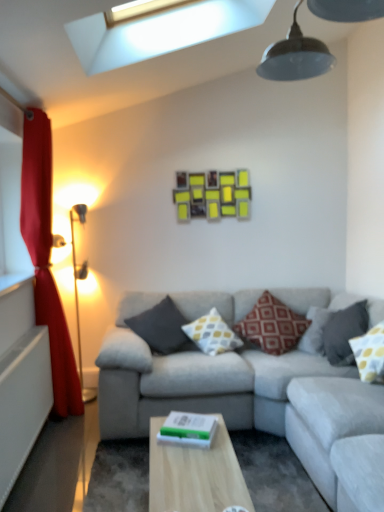
What is the approximate width of gray fabric couch at center?

gray fabric couch at center is 2.22 meters in width.

Find the location of `gray fabric couch at center`. gray fabric couch at center is located at coordinates (228, 393).

The width and height of the screenshot is (384, 512). Describe the element at coordinates (212, 194) in the screenshot. I see `yellow matte picture frame at upper center` at that location.

Image resolution: width=384 pixels, height=512 pixels. Describe the element at coordinates (370, 354) in the screenshot. I see `yellow dotted fabric pillow at right, the first pillow in the right-to-left sequence` at that location.

Locate an element on the screen. The height and width of the screenshot is (512, 384). red velvet curtain at left is located at coordinates pyautogui.click(x=46, y=259).

Find the location of a particular element. The image size is (384, 512). gray fabric couch at center is located at coordinates (228, 393).

Considering the relative positions of gold metallic floor lamp at left and yellow dotted fabric pillow at right, marked as the fifth pillow in a left-to-right arrangement, in the image provided, is gold metallic floor lamp at left to the left or to the right of yellow dotted fabric pillow at right, marked as the fifth pillow in a left-to-right arrangement,?

gold metallic floor lamp at left is positioned on yellow dotted fabric pillow at right, marked as the fifth pillow in a left-to-right arrangement,'s left side.

Measure the distance from gold metallic floor lamp at left to yellow dotted fabric pillow at right, the first pillow in the right-to-left sequence.

They are 7.26 feet apart.

Is gold metallic floor lamp at left smaller than yellow dotted fabric pillow at right, marked as the fifth pillow in a left-to-right arrangement?

Actually, gold metallic floor lamp at left might be larger than yellow dotted fabric pillow at right, marked as the fifth pillow in a left-to-right arrangement.

From a real-world perspective, is gold metallic floor lamp at left positioned under yellow dotted fabric pillow at right, the first pillow in the right-to-left sequence, based on gravity?

No, from a real-world perspective, gold metallic floor lamp at left is not under yellow dotted fabric pillow at right, the first pillow in the right-to-left sequence.

Is point (214, 341) positioned after point (78, 338)?

That is False.

Is yellow dotted pillow at center, positioned as the fourth pillow in right-to-left order, spatially inside gold metallic floor lamp at left, or outside of it?

yellow dotted pillow at center, positioned as the fourth pillow in right-to-left order, is not inside gold metallic floor lamp at left, it's outside.

From a real-world perspective, is yellow dotted pillow at center, positioned as the fourth pillow in right-to-left order, physically below gold metallic floor lamp at left?

Yes, from a real-world perspective, yellow dotted pillow at center, positioned as the fourth pillow in right-to-left order, is below gold metallic floor lamp at left.

How far apart are yellow dotted pillow at center, the 2th pillow from the left, and gold metallic floor lamp at left?

yellow dotted pillow at center, the 2th pillow from the left, is 3.62 feet from gold metallic floor lamp at left.

I want to click on the 4th pillow positioned below the yellow matte picture frame at upper center (from the image's perspective), so click(162, 328).

How many degrees apart are the facing directions of yellow matte picture frame at upper center and dark gray fabric pillow at center, which is counted as the 5th pillow, starting from the right?

The facing directions of yellow matte picture frame at upper center and dark gray fabric pillow at center, which is counted as the 5th pillow, starting from the right, are 0.816 degrees apart.

Visually, is yellow matte picture frame at upper center positioned to the left or to the right of dark gray fabric pillow at center, marked as the 1th pillow in a left-to-right arrangement?

yellow matte picture frame at upper center is positioned on dark gray fabric pillow at center, marked as the 1th pillow in a left-to-right arrangement,'s right side.

Does yellow matte picture frame at upper center have a greater width compared to dark gray fabric pillow at center, which is counted as the 5th pillow, starting from the right?

In fact, yellow matte picture frame at upper center might be narrower than dark gray fabric pillow at center, which is counted as the 5th pillow, starting from the right.

Which object is thinner, yellow dotted pillow at center, positioned as the fourth pillow in right-to-left order, or red velvet curtain at left?

Thinner between the two is red velvet curtain at left.

From the image's perspective, relative to red velvet curtain at left, is yellow dotted pillow at center, positioned as the fourth pillow in right-to-left order, above or below?

Based on their image positions, yellow dotted pillow at center, positioned as the fourth pillow in right-to-left order, is located beneath red velvet curtain at left.

Is yellow dotted pillow at center, positioned as the fourth pillow in right-to-left order, outside of red velvet curtain at left?

yellow dotted pillow at center, positioned as the fourth pillow in right-to-left order, lies outside red velvet curtain at left's area.

Considering the relative positions of yellow dotted pillow at center, the 2th pillow from the left, and red velvet curtain at left in the image provided, is yellow dotted pillow at center, the 2th pillow from the left, in front of red velvet curtain at left?

No, yellow dotted pillow at center, the 2th pillow from the left, is further to the viewer.

From the picture: Would you consider dark gray fabric pillow at right, which ranks as the 4th pillow in left-to-right order, to be distant from light wood table at center?

Indeed, dark gray fabric pillow at right, which ranks as the 4th pillow in left-to-right order, is not near light wood table at center.

Is light wood table at center inside dark gray fabric pillow at right, which ranks as the 4th pillow in left-to-right order?

No, light wood table at center is not surrounded by dark gray fabric pillow at right, which ranks as the 4th pillow in left-to-right order.

From the image's perspective, which one is positioned lower, dark gray fabric pillow at right, which ranks as the 4th pillow in left-to-right order, or light wood table at center?

light wood table at center, from the image's perspective.

Which object is wider, dark gray fabric pillow at right, acting as the 2th pillow starting from the right, or light wood table at center?

light wood table at center.

Looking at this image, who is more distant, gold metallic floor lamp at left or red textured pillow at center, which appears as the third pillow when viewed from the left?

gold metallic floor lamp at left is behind.

From the gold metallic floor lamp at left, count 1st pillows forward and point to it. Please provide its 2D coordinates.

[(272, 325)]

Is the surface of gold metallic floor lamp at left in direct contact with red textured pillow at center, which appears as the third pillow when viewed from the left?

gold metallic floor lamp at left and red textured pillow at center, which appears as the third pillow when viewed from the left, are clearly separated.

Is point (171, 327) closer to camera compared to point (245, 325)?

Yes, point (171, 327) is closer to viewer.

Based on the photo, is dark gray fabric pillow at center, which is counted as the 5th pillow, starting from the right, with red textured pillow at center, which appears as the third pillow when viewed from the left?

No, dark gray fabric pillow at center, which is counted as the 5th pillow, starting from the right, is not beside red textured pillow at center, which appears as the third pillow when viewed from the left.

Is dark gray fabric pillow at center, marked as the 1th pillow in a left-to-right arrangement, aimed at red textured pillow at center, which is counted as the 3th pillow, starting from the right?

No, dark gray fabric pillow at center, marked as the 1th pillow in a left-to-right arrangement, is not aimed at red textured pillow at center, which is counted as the 3th pillow, starting from the right.

From a real-world perspective, relative to red textured pillow at center, which appears as the third pillow when viewed from the left, is dark gray fabric pillow at center, which is counted as the 5th pillow, starting from the right, vertically above or below?

From a real-world perspective, dark gray fabric pillow at center, which is counted as the 5th pillow, starting from the right, is physically below red textured pillow at center, which appears as the third pillow when viewed from the left.

The image size is (384, 512). Identify the location of the 5th pillow counting from the right side of the gold metallic floor lamp at left. (370, 354).

Where is `the 2nd pillow below the gold metallic floor lamp at left (from a real-world perspective)`? The image size is (384, 512). the 2nd pillow below the gold metallic floor lamp at left (from a real-world perspective) is located at coordinates (212, 334).

From the image, which object appears to be nearer to dark gray fabric pillow at center, marked as the 1th pillow in a left-to-right arrangement, yellow dotted fabric pillow at right, marked as the fifth pillow in a left-to-right arrangement, or gold metallic floor lamp at left?

gold metallic floor lamp at left.

When comparing their distances from dark gray fabric pillow at right, acting as the 2th pillow starting from the right, does light wood table at center or yellow dotted pillow at center, positioned as the fourth pillow in right-to-left order, seem further?

light wood table at center is positioned further to the anchor dark gray fabric pillow at right, acting as the 2th pillow starting from the right.

Estimate the real-world distances between objects in this image. Which object is further from red textured pillow at center, which is counted as the 3th pillow, starting from the right, gold metallic floor lamp at left or dark gray fabric pillow at right, acting as the 2th pillow starting from the right?

Among the two, gold metallic floor lamp at left is located further to red textured pillow at center, which is counted as the 3th pillow, starting from the right.

When comparing their distances from dark gray fabric pillow at center, which is counted as the 5th pillow, starting from the right, does red textured pillow at center, which is counted as the 3th pillow, starting from the right, or light wood table at center seem further?

light wood table at center.

Estimate the real-world distances between objects in this image. Which object is further from red velvet curtain at left, yellow dotted fabric pillow at right, marked as the fifth pillow in a left-to-right arrangement, or red textured pillow at center, which is counted as the 3th pillow, starting from the right?

yellow dotted fabric pillow at right, marked as the fifth pillow in a left-to-right arrangement.

Estimate the real-world distances between objects in this image. Which object is closer to gray fabric couch at center, dark gray fabric pillow at center, marked as the 1th pillow in a left-to-right arrangement, or red textured pillow at center, which appears as the third pillow when viewed from the left?

red textured pillow at center, which appears as the third pillow when viewed from the left.

Looking at the image, which one is located closer to red velvet curtain at left, gray fabric couch at center or red textured pillow at center, which appears as the third pillow when viewed from the left?

Among the two, gray fabric couch at center is located nearer to red velvet curtain at left.

Considering their positions, is light wood table at center positioned closer to yellow dotted fabric pillow at right, marked as the fifth pillow in a left-to-right arrangement, than yellow matte picture frame at upper center?

light wood table at center is closer to yellow dotted fabric pillow at right, marked as the fifth pillow in a left-to-right arrangement.

Find the location of a particular element. This screenshot has height=512, width=384. pillow between gray fabric couch at center and dark gray fabric pillow at right, which ranks as the 4th pillow in left-to-right order, along the z-axis is located at coordinates (370, 354).

Where is `pillow between yellow dotted pillow at center, positioned as the fourth pillow in right-to-left order, and dark gray fabric pillow at right, which ranks as the 4th pillow in left-to-right order, in the horizontal direction`? The width and height of the screenshot is (384, 512). pillow between yellow dotted pillow at center, positioned as the fourth pillow in right-to-left order, and dark gray fabric pillow at right, which ranks as the 4th pillow in left-to-right order, in the horizontal direction is located at coordinates coord(272,325).

Image resolution: width=384 pixels, height=512 pixels. What are the coordinates of `table between gray fabric couch at center and gold metallic floor lamp at left from front to back` in the screenshot? It's located at (x=195, y=474).

Find the location of `curtain positioned between gray fabric couch at center and dark gray fabric pillow at center, marked as the 1th pillow in a left-to-right arrangement, from near to far`. curtain positioned between gray fabric couch at center and dark gray fabric pillow at center, marked as the 1th pillow in a left-to-right arrangement, from near to far is located at coordinates (46, 259).